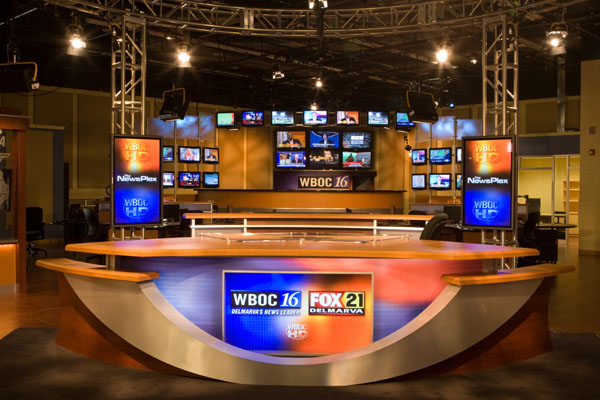
I want to click on counter, so click(302, 253), click(345, 215).